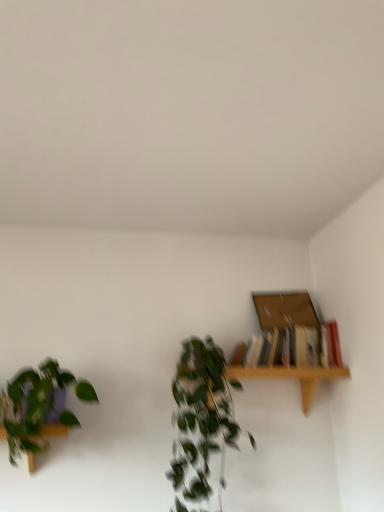
What do you see at coordinates (202, 419) in the screenshot? This screenshot has width=384, height=512. I see `green leafy plant at center, marked as the 1th houseplant in a right-to-left arrangement` at bounding box center [202, 419].

The height and width of the screenshot is (512, 384). Describe the element at coordinates (285, 310) in the screenshot. I see `brown cardboard box at upper right` at that location.

Describe the element at coordinates (39, 408) in the screenshot. I see `green matte plant at left, the second houseplant from the right` at that location.

Where is `green leafy plant at center, marked as the 1th houseplant in a right-to-left arrangement`? green leafy plant at center, marked as the 1th houseplant in a right-to-left arrangement is located at coordinates (202, 419).

Is hardcover books at upper right positioned far away from brown cardboard box at upper right?

Actually, hardcover books at upper right and brown cardboard box at upper right are a little close together.

Which of these two, hardcover books at upper right or brown cardboard box at upper right, is smaller?

brown cardboard box at upper right.

The width and height of the screenshot is (384, 512). I want to click on book on the left of brown cardboard box at upper right, so (x=330, y=344).

In terms of height, does hardcover books at upper right look taller or shorter compared to brown cardboard box at upper right?

hardcover books at upper right is shorter than brown cardboard box at upper right.

Is green leafy plant at center, marked as the 1th houseplant in a right-to-left arrangement, placed right next to light wood shelf at upper right?

No.

Measure the distance from green leafy plant at center, which is counted as the second houseplant, starting from the left, to light wood shelf at upper right.

green leafy plant at center, which is counted as the second houseplant, starting from the left, is 20.64 centimeters from light wood shelf at upper right.

Is green leafy plant at center, marked as the 1th houseplant in a right-to-left arrangement, aimed at light wood shelf at upper right?

No, green leafy plant at center, marked as the 1th houseplant in a right-to-left arrangement, does not turn towards light wood shelf at upper right.

From a real-world perspective, which is physically above, green leafy plant at center, which is counted as the second houseplant, starting from the left, or light wood shelf at upper right?

light wood shelf at upper right is physically above.

Locate an element on the screen. Image resolution: width=384 pixels, height=512 pixels. box on the right side of green matte plant at left, the second houseplant from the right is located at coordinates (285, 310).

From the image's perspective, is brown cardboard box at upper right located above green matte plant at left, the second houseplant from the right?

Yes, from the image's perspective, brown cardboard box at upper right is over green matte plant at left, the second houseplant from the right.

Does point (296, 322) come farther from viewer compared to point (29, 404)?

That is True.

Does brown cardboard box at upper right have a larger size compared to green matte plant at left, the first houseplant positioned from the left?

No.

Is light wood shelf at upper right further to the viewer compared to brown cardboard box at upper right?

No, it is in front of brown cardboard box at upper right.

Is light wood shelf at upper right to the right of brown cardboard box at upper right from the viewer's perspective?

Incorrect, light wood shelf at upper right is not on the right side of brown cardboard box at upper right.

Is light wood shelf at upper right aimed at brown cardboard box at upper right?

No, light wood shelf at upper right is not aimed at brown cardboard box at upper right.

How distant is light wood shelf at upper right from brown cardboard box at upper right?

light wood shelf at upper right and brown cardboard box at upper right are 12.10 inches apart from each other.

From a real-world perspective, which houseplant is the 2nd one underneath the brown cardboard box at upper right? Please provide its 2D coordinates.

[(202, 419)]

From the image's perspective, which one is positioned higher, green leafy plant at center, marked as the 1th houseplant in a right-to-left arrangement, or brown cardboard box at upper right?

brown cardboard box at upper right, from the image's perspective.

Can brown cardboard box at upper right be found inside green leafy plant at center, marked as the 1th houseplant in a right-to-left arrangement?

That's incorrect, brown cardboard box at upper right is not inside green leafy plant at center, marked as the 1th houseplant in a right-to-left arrangement.

From the image's perspective, would you say light wood shelf at upper right is shown under green matte plant at left, the first houseplant positioned from the left?

Yes, from the image's perspective, light wood shelf at upper right is below green matte plant at left, the first houseplant positioned from the left.

Is the position of light wood shelf at upper right less distant than that of green matte plant at left, the second houseplant from the right?

No, it is behind green matte plant at left, the second houseplant from the right.

Would you consider light wood shelf at upper right to be distant from green matte plant at left, the first houseplant positioned from the left?

No.

Considering the relative sizes of light wood shelf at upper right and green matte plant at left, the second houseplant from the right, in the image provided, is light wood shelf at upper right thinner than green matte plant at left, the second houseplant from the right,?

Correct, the width of light wood shelf at upper right is less than that of green matte plant at left, the second houseplant from the right.

From the image's perspective, is brown cardboard box at upper right below hardcover books at upper right?

No.

Looking at their sizes, would you say brown cardboard box at upper right is wider or thinner than hardcover books at upper right?

brown cardboard box at upper right is thinner than hardcover books at upper right.

Which is nearer, [313,324] or [333,336]?

Point [313,324].

From a real-world perspective, which object rests below the other?

In real-world perspective, hardcover books at upper right is lower.

The height and width of the screenshot is (512, 384). I want to click on book on the left of the brown cardboard box at upper right, so click(x=330, y=344).

The width and height of the screenshot is (384, 512). Identify the location of table behind the green leafy plant at center, which is counted as the second houseplant, starting from the left. (291, 377).

Which object lies nearer to the anchor point hardcover books at upper right, light wood shelf at upper right or green matte plant at left, the first houseplant positioned from the left?

light wood shelf at upper right is closer to hardcover books at upper right.

Considering their positions, is brown cardboard box at upper right positioned further to hardcover books at upper right than green matte plant at left, the second houseplant from the right?

The object further to hardcover books at upper right is green matte plant at left, the second houseplant from the right.

Looking at the image, which one is located closer to hardcover books at upper right, green leafy plant at center, which is counted as the second houseplant, starting from the left, or brown cardboard box at upper right?

Based on the image, brown cardboard box at upper right appears to be nearer to hardcover books at upper right.

Which object lies further to the anchor point light wood shelf at upper right, green leafy plant at center, which is counted as the second houseplant, starting from the left, or green matte plant at left, the second houseplant from the right?

The object further to light wood shelf at upper right is green matte plant at left, the second houseplant from the right.

Looking at the image, which one is located further to green matte plant at left, the second houseplant from the right, light wood shelf at upper right or brown cardboard box at upper right?

brown cardboard box at upper right is positioned further to the anchor green matte plant at left, the second houseplant from the right.

Looking at this image, looking at the image, which one is located further to hardcover books at upper right, brown cardboard box at upper right or green leafy plant at center, which is counted as the second houseplant, starting from the left?

Among the two, green leafy plant at center, which is counted as the second houseplant, starting from the left, is located further to hardcover books at upper right.

Looking at the image, which one is located further to green matte plant at left, the second houseplant from the right, light wood shelf at upper right or green leafy plant at center, marked as the 1th houseplant in a right-to-left arrangement?

Based on the image, light wood shelf at upper right appears to be further to green matte plant at left, the second houseplant from the right.

Estimate the real-world distances between objects in this image. Which object is further from green leafy plant at center, marked as the 1th houseplant in a right-to-left arrangement, brown cardboard box at upper right or green matte plant at left, the second houseplant from the right?

green matte plant at left, the second houseplant from the right, is positioned further to the anchor green leafy plant at center, marked as the 1th houseplant in a right-to-left arrangement.

The height and width of the screenshot is (512, 384). In order to click on table between green matte plant at left, the first houseplant positioned from the left, and hardcover books at upper right from left to right in this screenshot , I will do `click(291, 377)`.

This screenshot has width=384, height=512. I want to click on book between light wood shelf at upper right and brown cardboard box at upper right from front to back, so click(330, 344).

I want to click on houseplant between green matte plant at left, the first houseplant positioned from the left, and hardcover books at upper right, so click(202, 419).

Image resolution: width=384 pixels, height=512 pixels. I want to click on table between green leafy plant at center, marked as the 1th houseplant in a right-to-left arrangement, and brown cardboard box at upper right from front to back, so click(x=291, y=377).